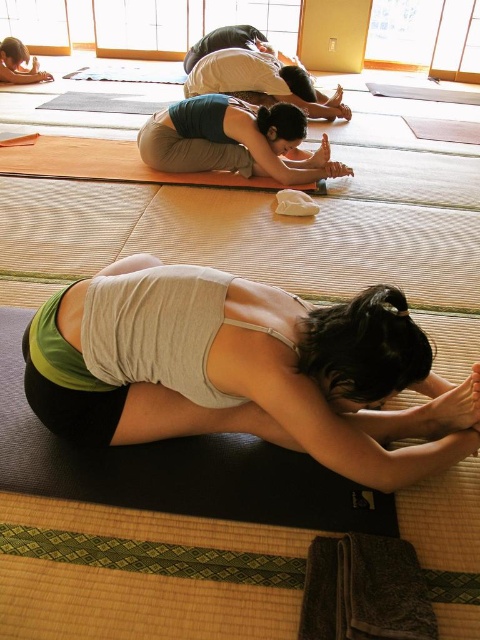
You are a photographer trying to capture the yoga pose of the woman in the image. You want to ensure that the point at coordinate (300, 388) is visible in your shot. Which part of her clothing should you focus on to make sure this point is included?

The point at coordinate (300, 388) is on the white matte tank top at center, so focusing on that area will ensure the point is visible in the shot.

You are a photographer setting up for a photoshoot in the room. You need to ensure that the white matte tank top at center is visible in the frame without being obscured by the teal fabric yoga mat at center. Based on their positions, can you confirm if the tank top will be visible?

The white matte tank top at center has a greater height compared to the teal fabric yoga mat at center, so the tank top will be visible above the yoga mat.